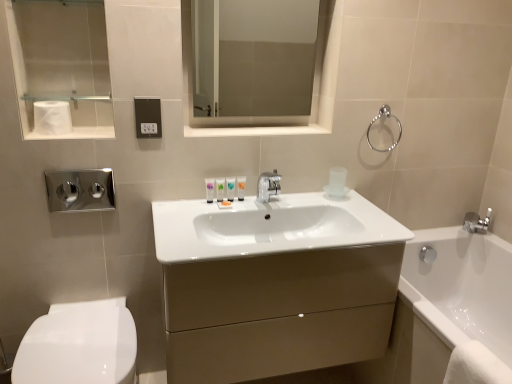
Find the location of a particular element. The height and width of the screenshot is (384, 512). vacant space situated above white glossy toilet at lower left (from a real-world perspective) is located at coordinates (76, 339).